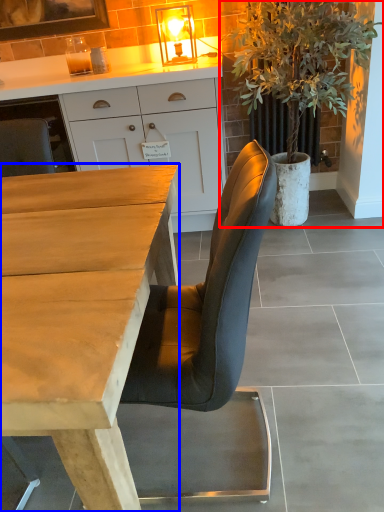
Question: Which object appears closest to the camera in this image, houseplant (highlighted by a red box) or desk (highlighted by a blue box)?

Choices:
 (A) houseplant
 (B) desk

Answer: (B)